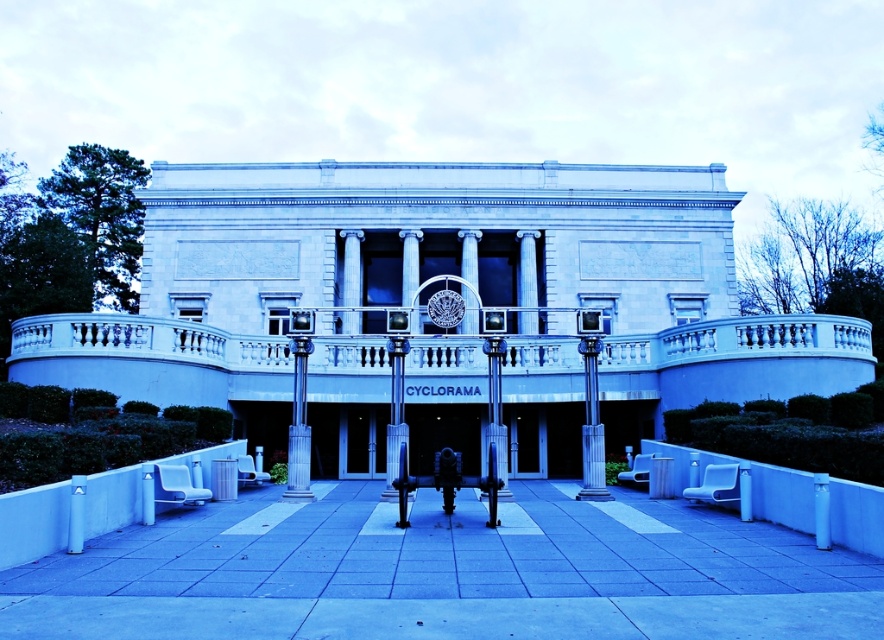
You are standing at the entrance of the CYCLORAMA building and want to place a small potted plant exactly where the smooth concrete pavement at center meets the slate gray stone column at center. Is this possible?

The smooth concrete pavement at center is positioned under the slate gray stone column at center, so they do not meet at a point where you can place the potted plant there.

You are an architect designing a new building inspired by classical architecture. You want to ensure that the pillars in your design maintain a harmonious balance between the polished metal pillar at center and the white glossy pillar at lower right. Given their widths, which pillar should you make wider in your design to maintain this balance?

To maintain harmonious balance between the pillars, the polished metal pillar at center should be made wider than the white glossy pillar at lower right, as it is already wider in the original design.

You are an architect planning to install a new light fixture. You need to choose between placing it on the polished metal pillar at center or the white glossy pillar at lower right. Based on their heights, which pillar would allow the light fixture to be placed higher?

The polished metal pillar at center is much taller than the white glossy pillar at lower right, so placing the light fixture on the polished metal pillar at center would allow it to be placed higher.